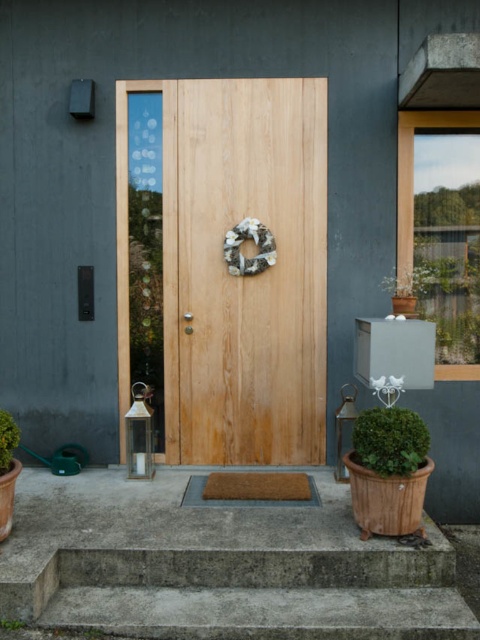
You are standing at the entrance of the house and want to place a small decorative item. You have two options for placement locations marked as point A at coordinates point A is point (9, 419) and point B at coordinates point B is point (8, 620). Based on the scene description, which point is closer to the wall? Please choose between point A and point B.

Point A at coordinates point (9, 419) is closer to the wall because it is behind point B at coordinates point (8, 620).

You are standing at the entrance of the modern house and see the wooden door with a natural finish. There is a decorative wreath on the center of the door and a mailbox to the right. You notice a point marked at coordinates (7, 440). Based on the scene description, what object is located at this point?

The point at coordinates (7, 440) corresponds to the green leafy bush at lower left.

You are a delivery person approaching the house entrance. You see the green matte potted plant at lower right and the green leafy plant at lower left. Which plant is closer to the right side of the entrance?

The green matte potted plant at lower right is closer to the right side of the entrance because it is positioned to the right of the green leafy plant at lower left.